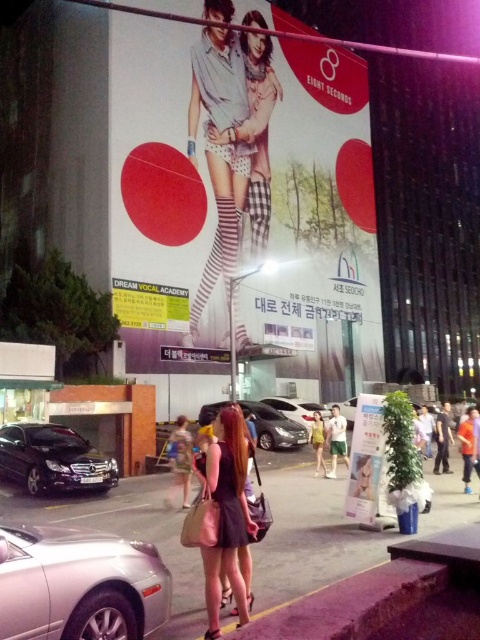
Consider the image. Measure the distance between point [304,435] and camera.

A distance of 16.90 meters exists between point [304,435] and camera.

Between point (202, 412) and point (321, 451), which one is positioned behind?

Positioned behind is point (202, 412).

I want to click on satin silver sedan at center, so click(275, 428).

Is purple asphalt at lower left to the left of matte purple dress at center from the viewer's perspective?

No, purple asphalt at lower left is not to the left of matte purple dress at center.

Does purple asphalt at lower left come in front of matte purple dress at center?

No, purple asphalt at lower left is further to the viewer.

Identify the location of purple asphalt at lower left. (308, 531).

Is point (287, 81) farther from viewer compared to point (465, 502)?

Yes, point (287, 81) is farther from viewer.

Can you confirm if matte white poster at center is smaller than purple asphalt at lower left?

Actually, matte white poster at center might be larger than purple asphalt at lower left.

Does point (236, 38) come in front of point (317, 504)?

No, it is not.

Identify the location of matte white poster at center. (242, 204).